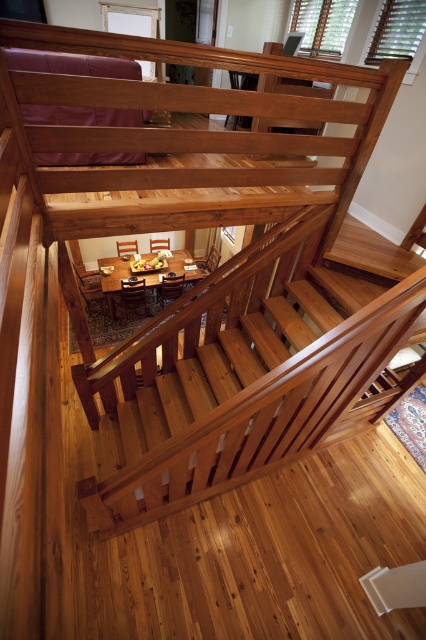
Question: Which object appears farthest from the camera in this image?

Choices:
 (A) brown wooden dining table at center
 (B) natural wood stairs at center

Answer: (A)

Question: Is natural wood stairs at center below brown wooden dining table at center?

Choices:
 (A) yes
 (B) no

Answer: (A)

Question: Can you confirm if natural wood stairs at center is thinner than brown wooden dining table at center?

Choices:
 (A) yes
 (B) no

Answer: (B)

Question: Is natural wood stairs at center to the right of brown wooden dining table at center from the viewer's perspective?

Choices:
 (A) no
 (B) yes

Answer: (B)